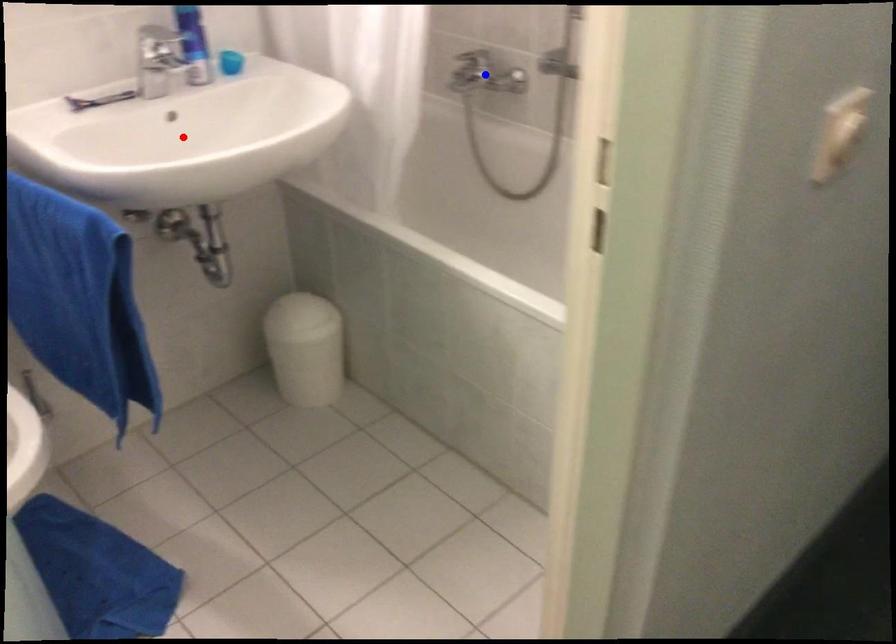
Question: Two points are marked on the image. Which point is closer to the camera?

Choices:
 (A) Blue point is closer.
 (B) Red point is closer.

Answer: (B)